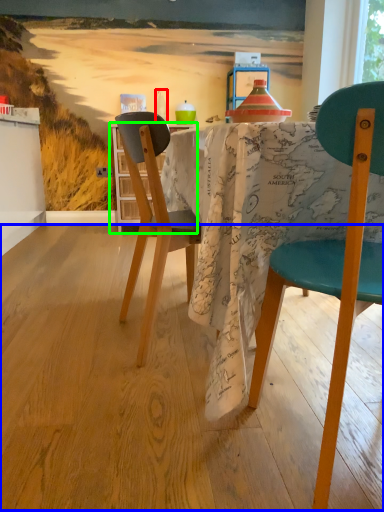
Question: Which object is positioned farthest from bottle (highlighted by a red box)? Select from plywood (highlighted by a blue box) and kitchen & dining room table (highlighted by a green box).

Choices:
 (A) plywood
 (B) kitchen & dining room table

Answer: (A)